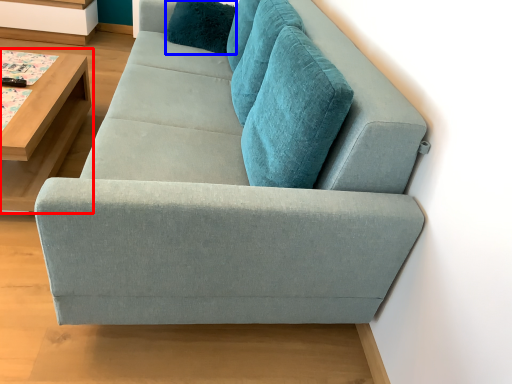
Question: Which point is further to the camera, table (highlighted by a red box) or pillow (highlighted by a blue box)?

Choices:
 (A) table
 (B) pillow

Answer: (B)